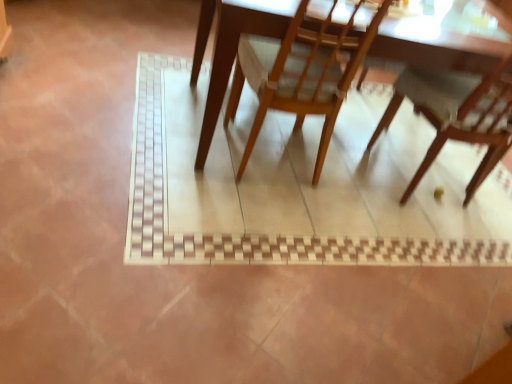
At what (x,y) coordinates should I click in order to perform the action: click on free space in front of wooden chair at lower right, which is the second chair from left to right. Please return your answer as a coordinate pair (x, y). Looking at the image, I should click on (404, 246).